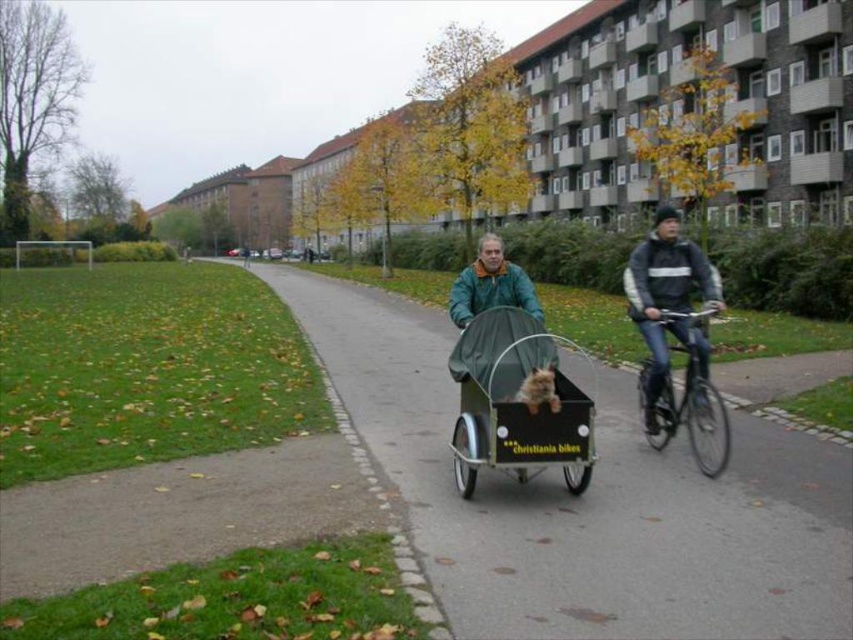
Looking at this image, you are a pedestrian standing at the point marked by the coordinates [664,292] in the image. Looking around, you see a dark gray jacket at center right. What is the nearest object to you besides the jacket?

The nearest object to you besides the dark gray jacket at center right is the grassy area with fallen leaves in the foreground, as it is part of the immediate surroundings at that point.

You are standing at the entrance of the park and want to locate the dark gray jacket at center right. According to the coordinates given, in which direction should you look to find it?

You should look towards the center right of the image to find the dark gray jacket at center right, as it is located at point (664, 292).